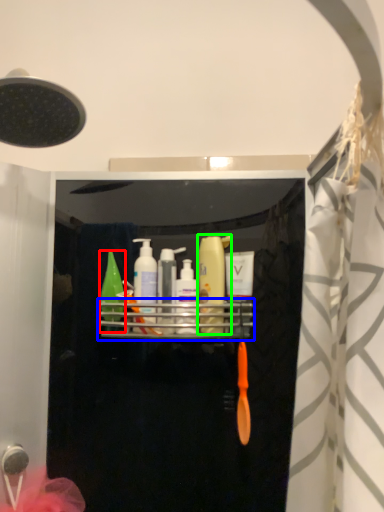
Question: Considering the real-world distances, which object is closest to mouthwash (highlighted by a red box)? shelf (highlighted by a blue box) or mouthwash (highlighted by a green box).

Choices:
 (A) shelf
 (B) mouthwash

Answer: (A)